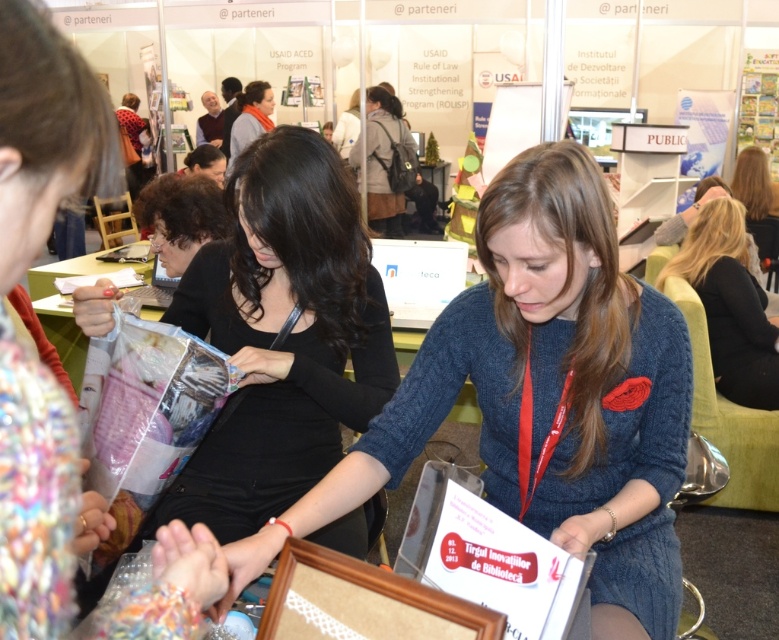
Is knitted sweater at center bigger than matte black scarf at upper center?

No.

Is knitted sweater at center above matte black scarf at upper center?

Incorrect, knitted sweater at center is not positioned above matte black scarf at upper center.

Who is more distant from viewer, (44, 381) or (263, 116)?

The point (263, 116) is more distant.

The width and height of the screenshot is (779, 640). I want to click on knitted sweater at center, so click(x=44, y=132).

Measure the distance between blue knitted sweater at center and blonde hair at right.

They are 1.96 meters apart.

Does blue knitted sweater at center have a lesser height compared to blonde hair at right?

Correct, blue knitted sweater at center is not as tall as blonde hair at right.

What are the coordinates of `blue knitted sweater at center` in the screenshot? It's located at (543, 396).

Can you confirm if brown wooden picture frame at center is positioned below blonde hair at right?

Correct, brown wooden picture frame at center is located below blonde hair at right.

Locate an element on the screen. This screenshot has width=779, height=640. brown wooden picture frame at center is located at coordinates (362, 602).

Find the location of `brown wooden picture frame at center`. brown wooden picture frame at center is located at coordinates (362, 602).